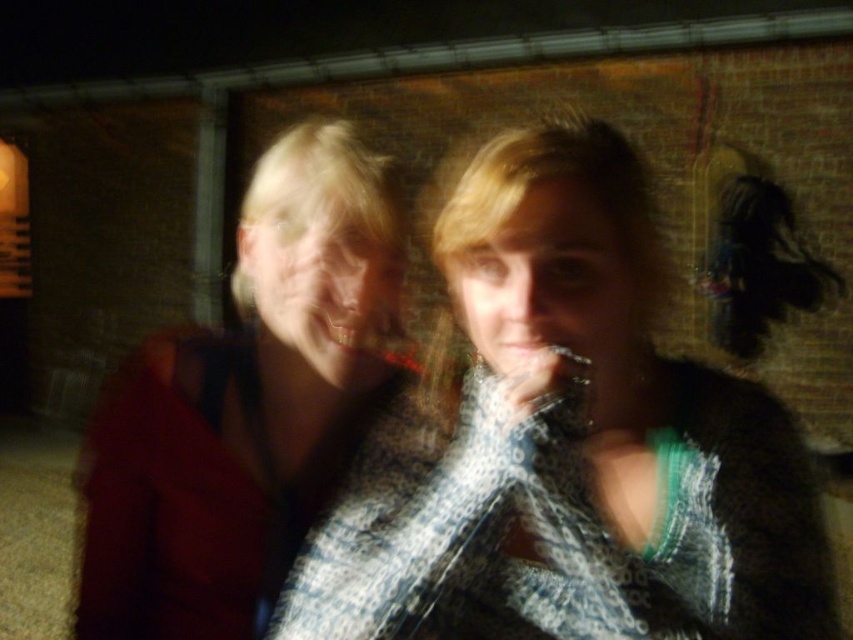
You are a photographer trying to focus on the two points in the image. Which point, point (218, 518) or point (505, 349), is closer to the camera?

Point (218, 518) is closer to the camera than point (505, 349).

From the picture: You are a photographer trying to adjust the focus on your camera. You want to ensure that both the matte red jacket at left and the matte plastic mouth at center are clearly visible in the photo. Given their sizes, which object should you prioritize focusing on first to ensure it remains sharp?

The matte red jacket at left is larger than the matte plastic mouth at center, so you should prioritize focusing on the matte red jacket at left first to ensure its sharpness.

You are a photographer trying to adjust the lighting for a night scene. You notice the matte red jacket at left and the matte plastic mouth at center. Which object is closer to the ground?

The matte red jacket at left is positioned under the matte plastic mouth at center, so it is closer to the ground.